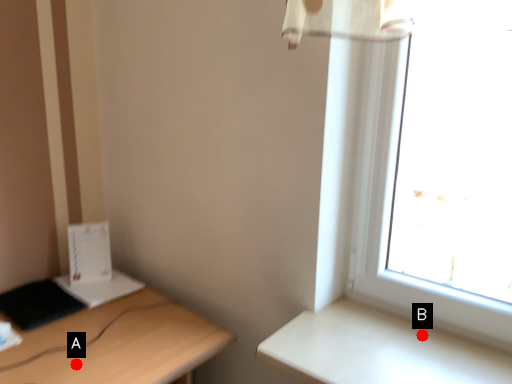
Question: Two points are circled on the image, labeled by A and B beside each circle. Which point is closer to the camera taking this photo?

Choices:
 (A) A is closer
 (B) B is closer

Answer: (B)